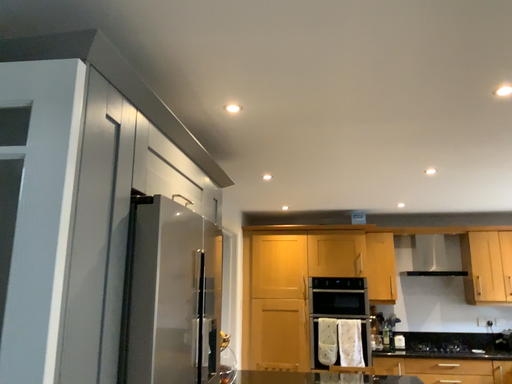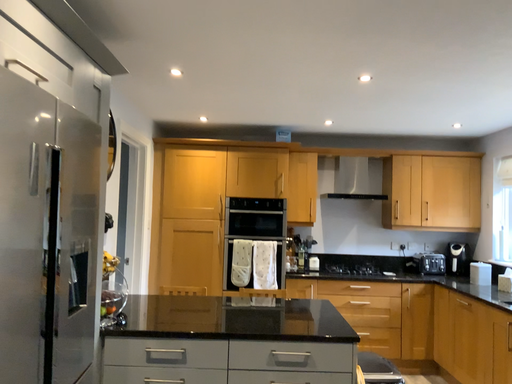
Question: Which way did the camera rotate in the video?

Choices:
 (A) rotated upward
 (B) rotated downward

Answer: (B)